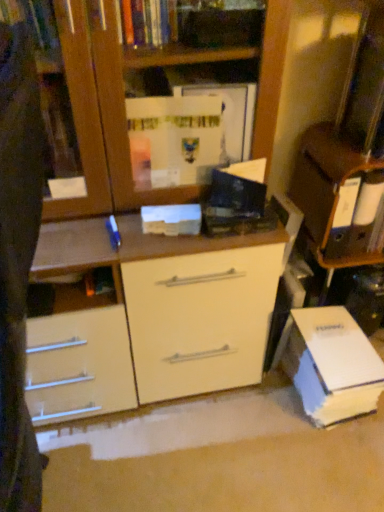
Describe the element at coordinates (172, 219) in the screenshot. I see `white matte paperback book at center, placed as the first paperback book when sorted from left to right` at that location.

Where is `white matte paperback book at center, the second paperback book in the right-to-left sequence`? white matte paperback book at center, the second paperback book in the right-to-left sequence is located at coordinates (172, 219).

This screenshot has width=384, height=512. Describe the element at coordinates (339, 199) in the screenshot. I see `white glossy cabinet at upper right` at that location.

The height and width of the screenshot is (512, 384). Describe the element at coordinates (330, 364) in the screenshot. I see `white cardboard book at lower right, which ranks as the 2th paperback book in top-to-bottom order` at that location.

You are a GUI agent. You are given a task and a screenshot of the screen. Output one action in this format:
    pyautogui.click(x=<x>, y=<y>)
    Task: Click on the white matte paperback book at center, arranged as the first paperback book when viewed from the front
    
    Given the screenshot: What is the action you would take?
    pyautogui.click(x=172, y=219)

Is there a large distance between white glossy cabinet at upper right and white matte paperback book at center, positioned as the 2th paperback book in bottom-to-top order?

white glossy cabinet at upper right is near white matte paperback book at center, positioned as the 2th paperback book in bottom-to-top order, not far away.

Which point is more forward, (x=315, y=126) or (x=168, y=224)?

Positioned in front is point (x=168, y=224).

Identify the location of cabinetry above the white matte paperback book at center, positioned as the 2th paperback book in bottom-to-top order (from the image's perspective). (339, 199).

Do you think white glossy cabinet at upper right is within white matte paperback book at center, the second paperback book in the right-to-left sequence, or outside of it?

The correct answer is: outside.

Are white matte paperback book at center, arranged as the first paperback book when viewed from the front, and white cardboard book at lower right, which ranks as the 2th paperback book in left-to-right order, making contact?

No, white matte paperback book at center, arranged as the first paperback book when viewed from the front, is not making contact with white cardboard book at lower right, which ranks as the 2th paperback book in left-to-right order.

Which of these two, white matte paperback book at center, which is the first paperback book from top to bottom, or white cardboard book at lower right, which ranks as the first paperback book in bottom-to-top order, stands shorter?

Standing shorter between the two is white matte paperback book at center, which is the first paperback book from top to bottom.

You are a GUI agent. You are given a task and a screenshot of the screen. Output one action in this format:
    pyautogui.click(x=<x>, y=<y>)
    Task: Click on the paperback book that is behind the white matte paperback book at center, which is the first paperback book from top to bottom
    This screenshot has width=384, height=512.
    Given the screenshot: What is the action you would take?
    pyautogui.click(x=330, y=364)

Does white matte paperback book at center, placed as the first paperback book when sorted from left to right, turn towards white cardboard book at lower right, which ranks as the first paperback book in bottom-to-top order?

No, white matte paperback book at center, placed as the first paperback book when sorted from left to right, is not turned towards white cardboard book at lower right, which ranks as the first paperback book in bottom-to-top order.

Is white matte paperback book at center, positioned as the 2th paperback book in bottom-to-top order, located outside white glossy cabinet at upper right?

white matte paperback book at center, positioned as the 2th paperback book in bottom-to-top order, lies outside white glossy cabinet at upper right's area.

Does point (185, 234) come behind point (352, 178)?

No, it is not.

Which is more to the left, white matte paperback book at center, positioned as the 2th paperback book in bottom-to-top order, or white glossy cabinet at upper right?

From the viewer's perspective, white matte paperback book at center, positioned as the 2th paperback book in bottom-to-top order, appears more on the left side.

Locate an element on the screen. The width and height of the screenshot is (384, 512). paperback book on the left of white cardboard book at lower right, which ranks as the 2th paperback book in left-to-right order is located at coordinates (172, 219).

From a real-world perspective, which is physically below, white cardboard book at lower right, which is the 1th paperback book from back to front, or white matte paperback book at center, which is the first paperback book from top to bottom?

white cardboard book at lower right, which is the 1th paperback book from back to front.

Is white cardboard book at lower right, which is counted as the first paperback book, starting from the right, behind white matte paperback book at center, placed as the first paperback book when sorted from left to right?

Yes, it is behind white matte paperback book at center, placed as the first paperback book when sorted from left to right.

Is white glossy cabinet at upper right inside the boundaries of white cardboard book at lower right, which ranks as the 2th paperback book in left-to-right order, or outside?

white glossy cabinet at upper right cannot be found inside white cardboard book at lower right, which ranks as the 2th paperback book in left-to-right order.

From the image's perspective, is white glossy cabinet at upper right above or below white cardboard book at lower right, which is counted as the first paperback book, starting from the right?

white glossy cabinet at upper right is above white cardboard book at lower right, which is counted as the first paperback book, starting from the right.

Is white glossy cabinet at upper right thinner than white cardboard book at lower right, which is counted as the first paperback book, starting from the right?

Yes.

Is white glossy cabinet at upper right facing towards white cardboard book at lower right, which ranks as the first paperback book in bottom-to-top order?

No.

Which object is closer to the camera, white cardboard book at lower right, which is counted as the first paperback book, starting from the right, or white glossy cabinet at upper right?

white glossy cabinet at upper right.

From the image's perspective, does white cardboard book at lower right, which is the 1th paperback book from back to front, appear higher than white glossy cabinet at upper right?

Incorrect, from the image's perspective, white cardboard book at lower right, which is the 1th paperback book from back to front, is lower than white glossy cabinet at upper right.

Is white cardboard book at lower right, arranged as the 2th paperback book when viewed from the front, wider than white glossy cabinet at upper right?

Indeed, white cardboard book at lower right, arranged as the 2th paperback book when viewed from the front, has a greater width compared to white glossy cabinet at upper right.

Is white cardboard book at lower right, which ranks as the 2th paperback book in top-to-bottom order, bigger or smaller than white glossy cabinet at upper right?

Considering their sizes, white cardboard book at lower right, which ranks as the 2th paperback book in top-to-bottom order, takes up more space than white glossy cabinet at upper right.

Identify the location of paperback book above the white glossy cabinet at upper right (from a real-world perspective). The height and width of the screenshot is (512, 384). (172, 219).

In the image, there is a white matte paperback book at center, placed as the first paperback book when sorted from left to right. Where is `paperback book below it (from the image's perspective)`? This screenshot has width=384, height=512. paperback book below it (from the image's perspective) is located at coordinates (330, 364).

In the scene shown: Considering their positions, is white cardboard book at lower right, which ranks as the 2th paperback book in left-to-right order, positioned closer to white glossy cabinet at upper right than white matte paperback book at center, positioned as the 2th paperback book in bottom-to-top order?

The object closer to white glossy cabinet at upper right is white cardboard book at lower right, which ranks as the 2th paperback book in left-to-right order.

Considering their positions, is white matte paperback book at center, positioned as the 2th paperback book in bottom-to-top order, positioned closer to white glossy cabinet at upper right than white cardboard book at lower right, arranged as the 2th paperback book when viewed from the front?

white cardboard book at lower right, arranged as the 2th paperback book when viewed from the front.

Which object lies further to the anchor point white cardboard book at lower right, which is counted as the first paperback book, starting from the right, white glossy cabinet at upper right or white matte paperback book at center, the second paperback book in the right-to-left sequence?

white matte paperback book at center, the second paperback book in the right-to-left sequence.

Based on their spatial positions, is white matte paperback book at center, placed as the first paperback book when sorted from left to right, or white glossy cabinet at upper right closer to white cardboard book at lower right, which ranks as the 2th paperback book in top-to-bottom order?

The object closer to white cardboard book at lower right, which ranks as the 2th paperback book in top-to-bottom order, is white glossy cabinet at upper right.

Looking at the image, which one is located further to white matte paperback book at center, positioned as the 2th paperback book in bottom-to-top order, white glossy cabinet at upper right or white cardboard book at lower right, which ranks as the 2th paperback book in top-to-bottom order?

Among the two, white cardboard book at lower right, which ranks as the 2th paperback book in top-to-bottom order, is located further to white matte paperback book at center, positioned as the 2th paperback book in bottom-to-top order.

Which object lies further to the anchor point white matte paperback book at center, which is the first paperback book from top to bottom, white cardboard book at lower right, which is counted as the first paperback book, starting from the right, or white glossy cabinet at upper right?

The object further to white matte paperback book at center, which is the first paperback book from top to bottom, is white cardboard book at lower right, which is counted as the first paperback book, starting from the right.

Locate an element on the screen. paperback book between white glossy cabinet at upper right and white cardboard book at lower right, which is counted as the first paperback book, starting from the right, in the up-down direction is located at coordinates (172, 219).